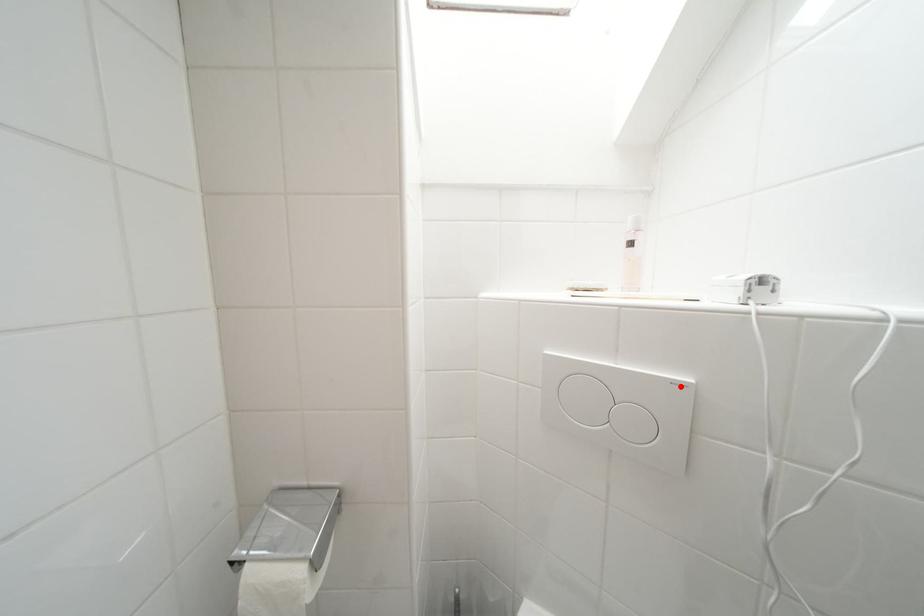
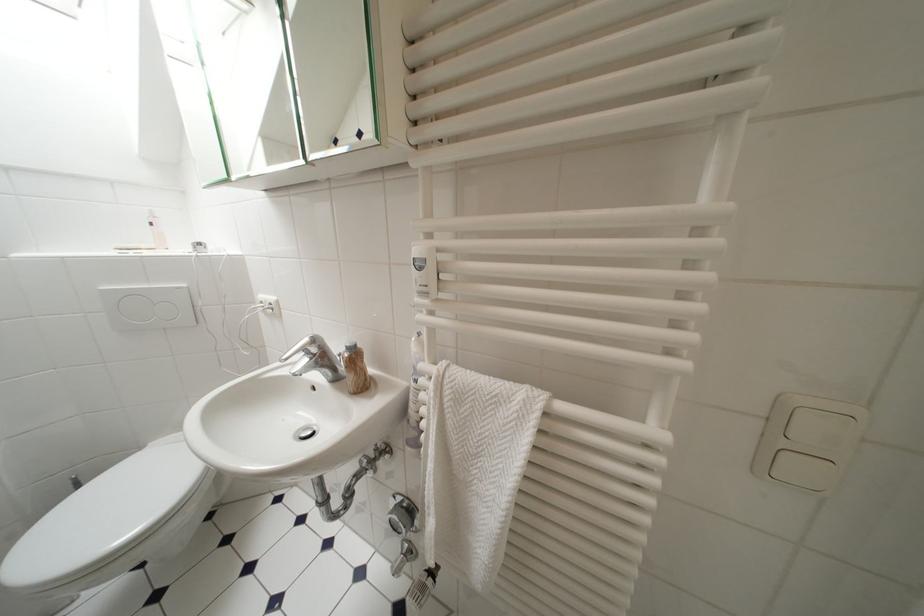
Question: I am providing you with two images of the same scene from different viewpoints. A red point is marked on the first image. Is the red point's position out of view in image 2?

Choices:
 (A) Yes
 (B) No

Answer: (B)